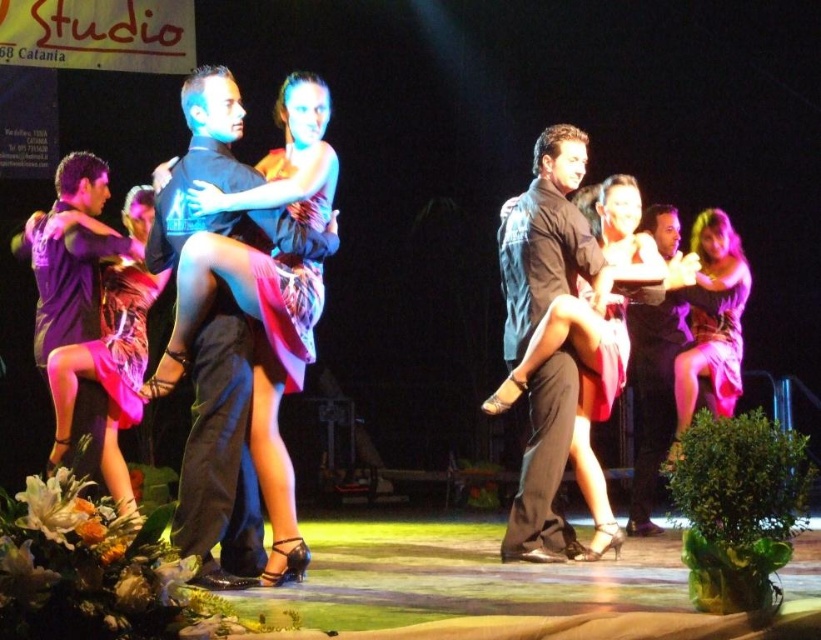
You are a photographer standing at the back of the theater. You want to take a photo of both the black smooth shirt at center and the pink satin dress at right. Which one will appear lower in the photo?

The black smooth shirt at center appears lower in the photo because it is positioned below the pink satin dress at right.

You are a photographer at the dance performance. You need to capture a photo of both the black satin suit at center and the black smooth shirt at center. Which one should you focus on first if you want to follow the natural left to right viewing order?

The black satin suit at center should be focused on first because it is positioned to the left of the black smooth shirt at center, following the natural left to right viewing order.

You are a photographer in the audience watching the dance performance. You want to take a photo of both the black satin suit at center and the black smooth shirt at center. Which one will appear closer to the camera in your photo?

The black satin suit at center will appear closer to the camera because it is in front of the black smooth shirt at center.